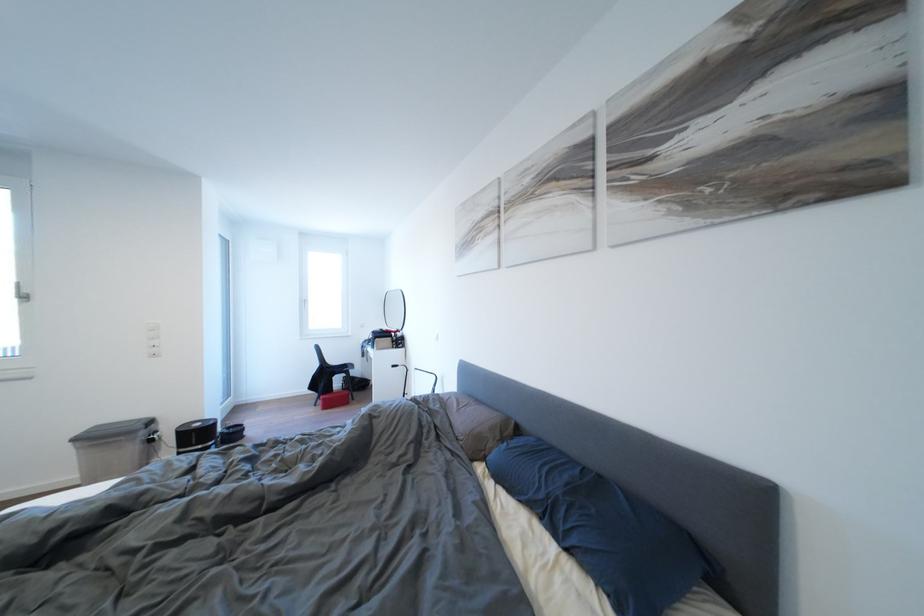
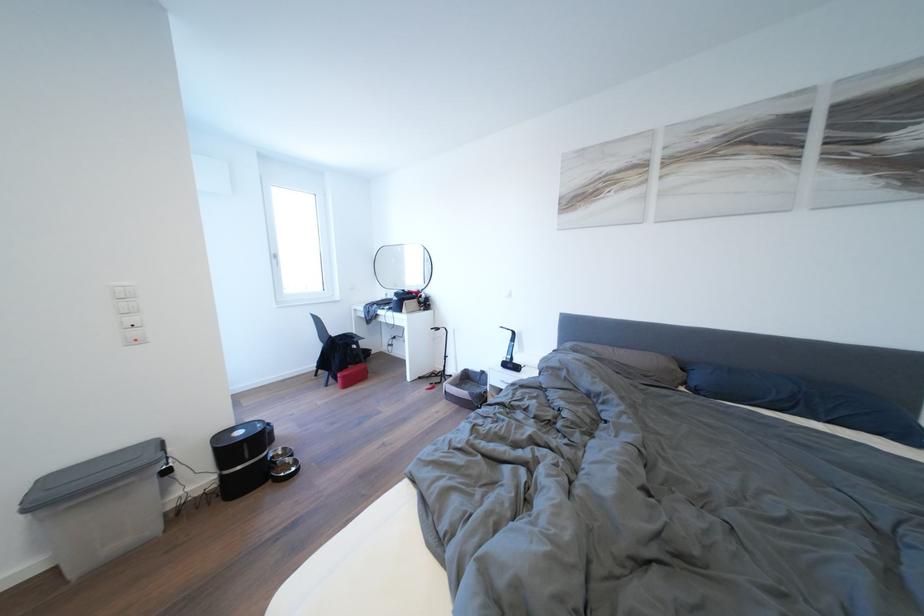
Question: In a continuous first-person perspective shot, in which direction is the camera moving?

Choices:
 (A) Left
 (B) Right
 (C) Forward
 (D) Backward

Answer: (A)